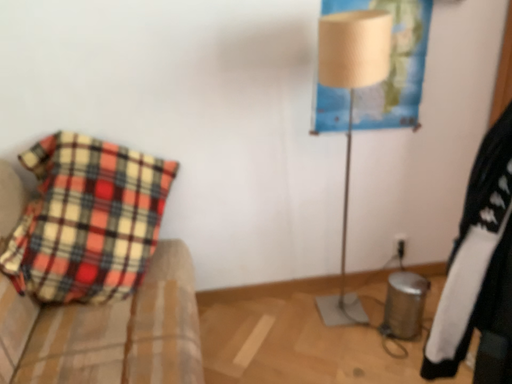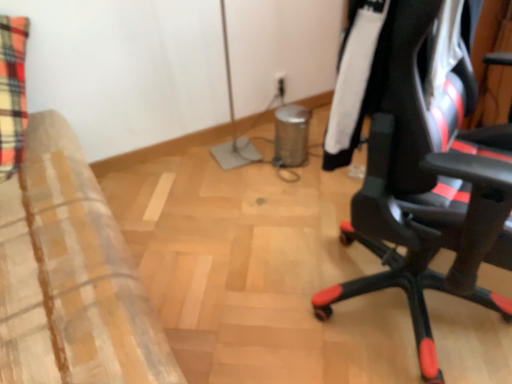
Question: How did the camera likely rotate when shooting the video?

Choices:
 (A) rotated left
 (B) rotated right

Answer: (B)